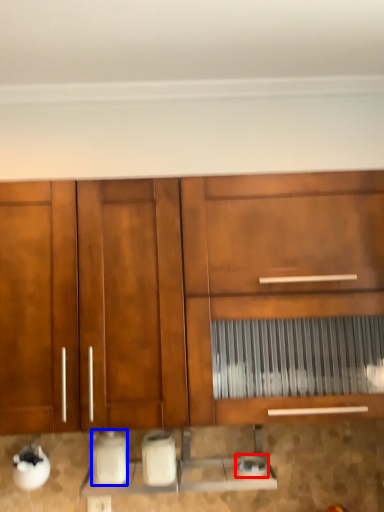
Question: Which of the following is the closest to the observer, appliance (highlighted by a red box) or appliance (highlighted by a blue box)?

Choices:
 (A) appliance
 (B) appliance

Answer: (B)